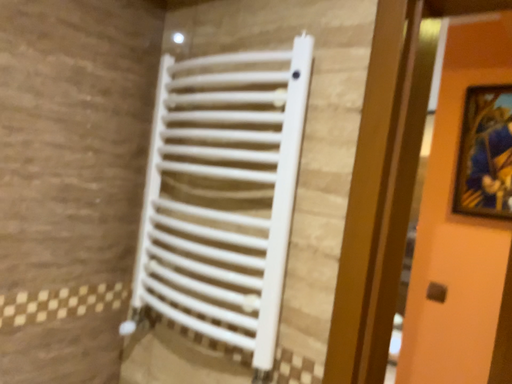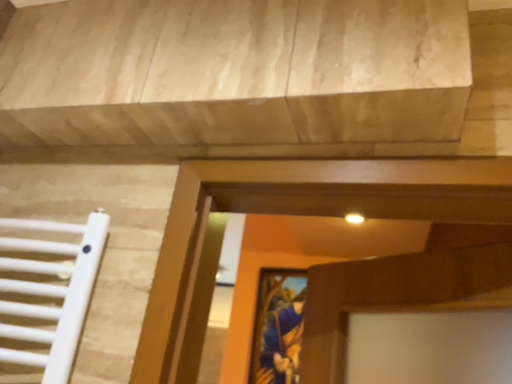
Question: How did the camera likely rotate when shooting the video?

Choices:
 (A) rotated downward
 (B) rotated upward

Answer: (B)